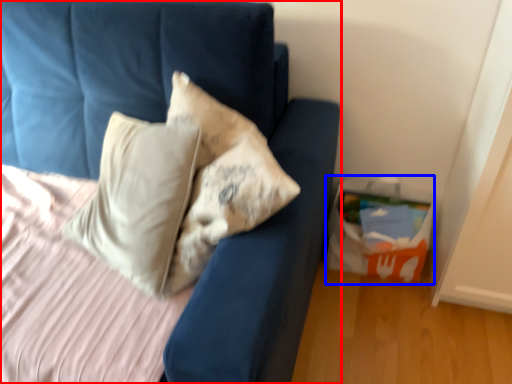
Question: Which object is further to the camera taking this photo, furniture (highlighted by a red box) or package (highlighted by a blue box)?

Choices:
 (A) furniture
 (B) package

Answer: (B)